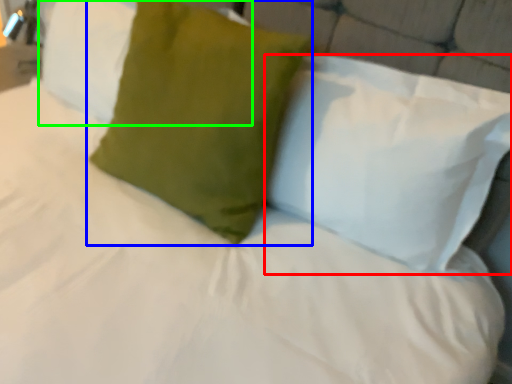
Question: Considering the real-world distances, which object is closest to pillow (highlighted by a red box)? pillow (highlighted by a blue box) or pillow (highlighted by a green box).

Choices:
 (A) pillow
 (B) pillow

Answer: (A)